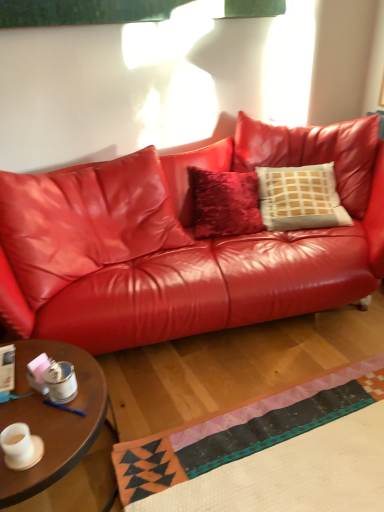
Question: Is glossy leather couch at center bigger or smaller than wooden round table at lower left?

Choices:
 (A) big
 (B) small

Answer: (A)

Question: Relative to wooden round table at lower left, is glossy leather couch at center in front or behind?

Choices:
 (A) behind
 (B) front

Answer: (A)

Question: Based on their relative distances, which object is nearer to the glossy leather couch at center?

Choices:
 (A) wooden round table at lower left
 (B) white textured pillow at center
 (C) matte white cup at lower left

Answer: (B)

Question: Which is farther from the glossy leather couch at center?

Choices:
 (A) white textured pillow at center
 (B) wooden round table at lower left
 (C) matte white cup at lower left

Answer: (C)